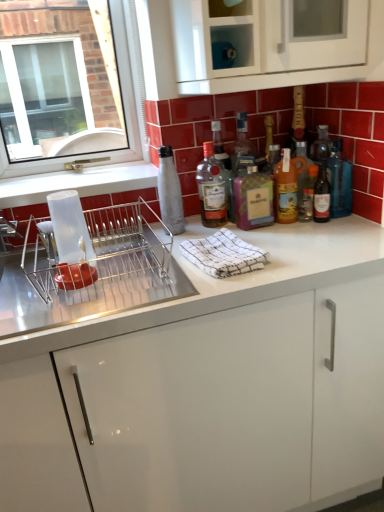
Find the location of a particular element. The width and height of the screenshot is (384, 512). unoccupied area in front of translucent glass bottles at center, the 2th bottle viewed from the right is located at coordinates (323, 234).